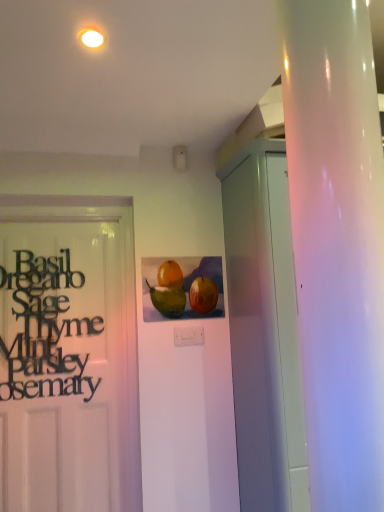
Question: Does point (162, 278) appear closer or farther from the camera than point (94, 30)?

Choices:
 (A) closer
 (B) farther

Answer: (B)

Question: Choose the correct answer: Is watercolor painting of fruits at center inside white glossy light fixture at upper center or outside it?

Choices:
 (A) outside
 (B) inside

Answer: (A)

Question: Which object is the closest to the black matte sign at left?

Choices:
 (A) watercolor painting of fruits at center
 (B) white glossy light fixture at upper center
 (C) white glossy cabinet at right

Answer: (A)

Question: Based on their relative distances, which object is farther from the white glossy light fixture at upper center?

Choices:
 (A) white glossy cabinet at right
 (B) black matte sign at left
 (C) watercolor painting of fruits at center

Answer: (B)